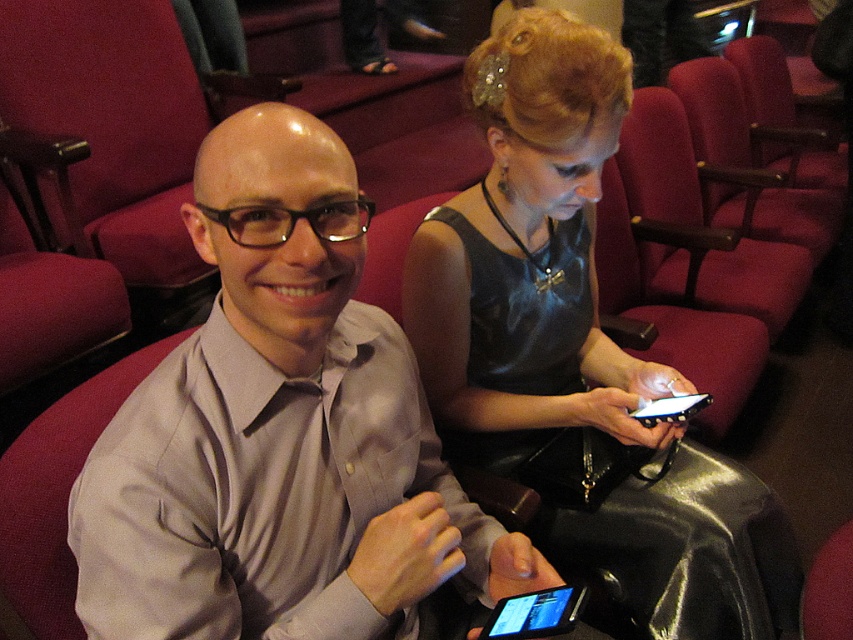
Question: Based on their relative distances, which object is nearer to the gray matte shirt at center?

Choices:
 (A) black glossy tablet at lower center
 (B) shiny black dress at center

Answer: (A)

Question: Does gray matte shirt at center have a greater width compared to black glossy tablet at lower center?

Choices:
 (A) yes
 (B) no

Answer: (A)

Question: Can you confirm if gray matte shirt at center is positioned to the left of shiny black dress at center?

Choices:
 (A) yes
 (B) no

Answer: (A)

Question: Among these objects, which one is farthest from the camera?

Choices:
 (A) shiny black dress at center
 (B) gray matte shirt at center
 (C) black glossy tablet at lower center

Answer: (A)

Question: Which point is farther from the camera taking this photo?

Choices:
 (A) (480, 392)
 (B) (527, 625)

Answer: (A)

Question: Does gray matte shirt at center appear on the right side of shiny black dress at center?

Choices:
 (A) yes
 (B) no

Answer: (B)